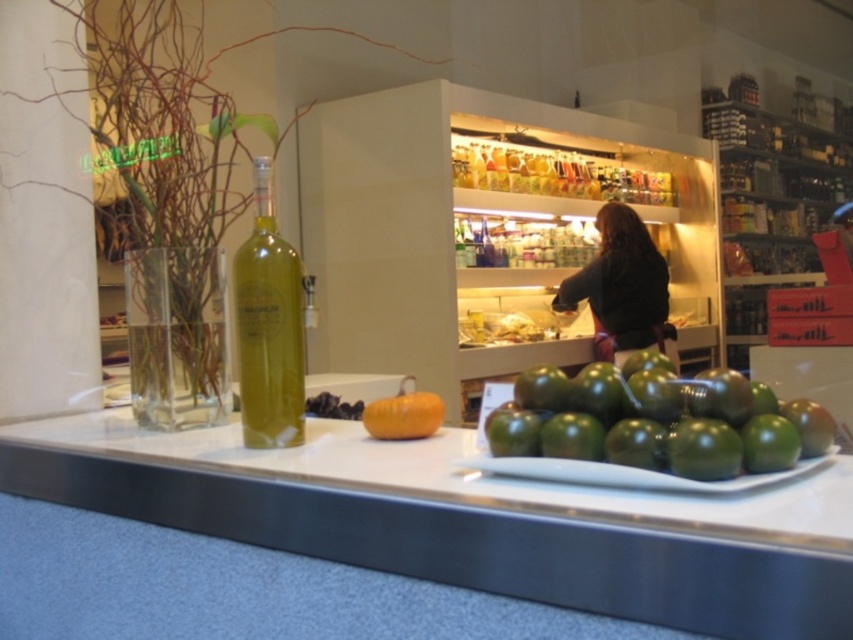
You are a customer in the store and want to place your bag on the white glossy counter at center. Can you confirm the exact coordinates where you should place it?

The white glossy counter at center is located at coordinates point (468, 518).

You are a customer in the store and want to place an item on the white glossy counter at center and the green matte tomatoes at center. Which object should you place closer to the left side of the counter?

You should place the item closer to the left side of the counter near the white glossy counter at center since it is positioned to the left of the green matte tomatoes at center.